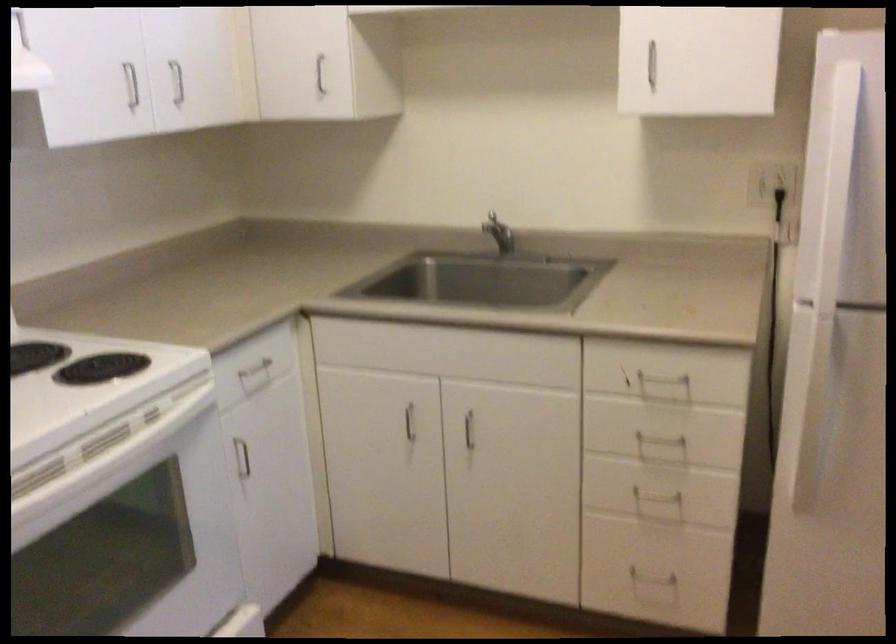
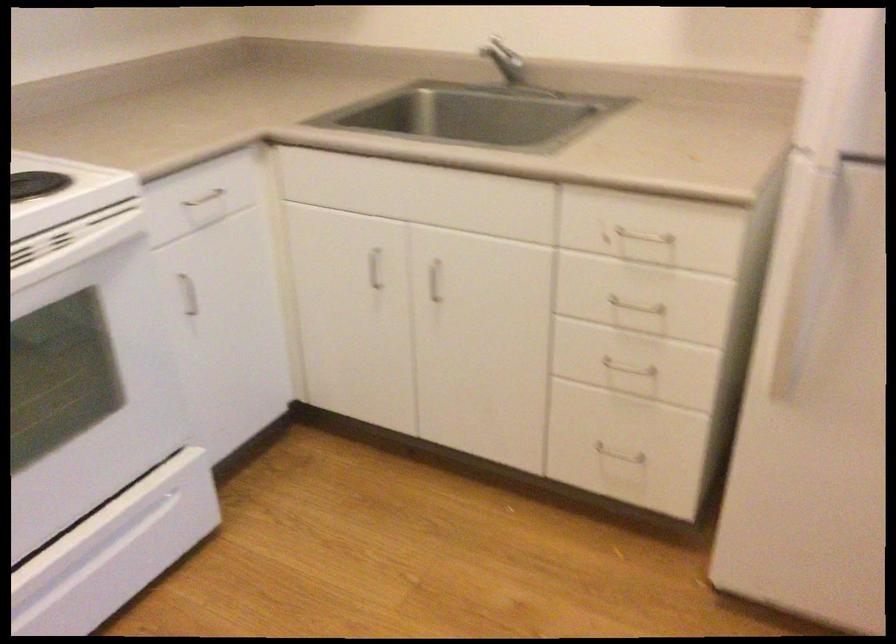
Which direction would the cameraman need to move to produce the second image?

The cameraman moved toward right, forward.